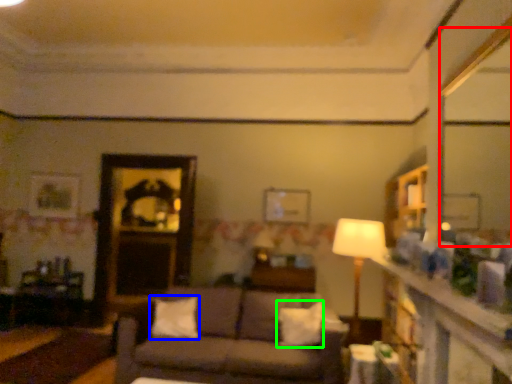
Question: Which is nearer to the mirror (highlighted by a red box)? pillow (highlighted by a blue box) or pillow (highlighted by a green box).

Choices:
 (A) pillow
 (B) pillow

Answer: (B)